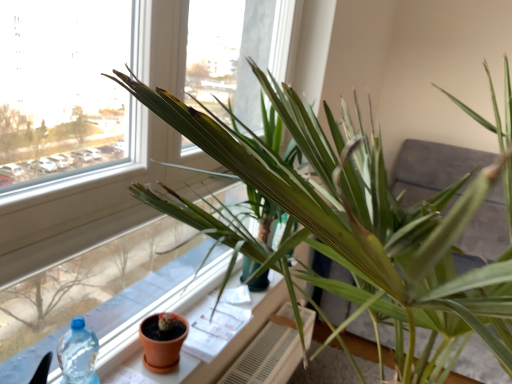
The height and width of the screenshot is (384, 512). What do you see at coordinates (160, 311) in the screenshot?
I see `terracotta clay pot at lower center` at bounding box center [160, 311].

Measure the distance between point (169, 338) and camera.

1.21 meters.

This screenshot has width=512, height=384. Find the location of `white textured radiator at lower center`. white textured radiator at lower center is located at coordinates (269, 353).

Is green matte plant at center located outside terracotta clay pot at lower left?

green matte plant at center is positioned outside terracotta clay pot at lower left.

Is green matte plant at center to the left or to the right of terracotta clay pot at lower left in the image?

In the image, green matte plant at center appears on the right side of terracotta clay pot at lower left.

Which object is closer to the camera taking this photo, green matte plant at center or terracotta clay pot at lower left?

green matte plant at center.

Consider the image. Considering the relative sizes of green matte plant at center and terracotta clay pot at lower left in the image provided, is green matte plant at center smaller than terracotta clay pot at lower left?

No.

Where is `radiator below the green matte plant at center (from a real-world perspective)`? This screenshot has height=384, width=512. radiator below the green matte plant at center (from a real-world perspective) is located at coordinates (269, 353).

Is white textured radiator at lower center looking in the opposite direction of green matte plant at center?

Correct, white textured radiator at lower center is looking away from green matte plant at center.

Can you tell me how much terracotta clay pot at lower center and terracotta clay pot at lower left differ in facing direction?

terracotta clay pot at lower center and terracotta clay pot at lower left are facing 3.34 degrees away from each other.

From a real-world perspective, which is physically below, terracotta clay pot at lower center or terracotta clay pot at lower left?

In real-world perspective, terracotta clay pot at lower center is lower.

Considering the relative positions of terracotta clay pot at lower center and terracotta clay pot at lower left in the image provided, is terracotta clay pot at lower center to the left of terracotta clay pot at lower left from the viewer's perspective?

No, terracotta clay pot at lower center is not to the left of terracotta clay pot at lower left.

Identify the location of flowerpot on the left of terracotta clay pot at lower center. Image resolution: width=512 pixels, height=384 pixels. (162, 342).

Is terracotta clay pot at lower left facing towards terracotta clay pot at lower center?

No.

From the image's perspective, is terracotta clay pot at lower left on top of terracotta clay pot at lower center?

Yes, from the image's perspective, terracotta clay pot at lower left is on top of terracotta clay pot at lower center.

Does terracotta clay pot at lower left appear on the right side of terracotta clay pot at lower center?

In fact, terracotta clay pot at lower left is to the left of terracotta clay pot at lower center.

Is point (169, 349) positioned after point (220, 364)?

No, (169, 349) is closer to viewer.

Does green matte plant at center touch white textured radiator at lower center?

No, green matte plant at center is not touching white textured radiator at lower center.

Is green matte plant at center taller than white textured radiator at lower center?

Yes, green matte plant at center is taller than white textured radiator at lower center.

Locate an element on the screen. houseplant above the white textured radiator at lower center (from a real-world perspective) is located at coordinates (353, 224).

Can you tell me how much terracotta clay pot at lower center and white textured radiator at lower center differ in facing direction?

1.19 degrees separate the facing orientations of terracotta clay pot at lower center and white textured radiator at lower center.

In the scene shown: From a real-world perspective, is terracotta clay pot at lower center above or below white textured radiator at lower center?

terracotta clay pot at lower center is situated higher than white textured radiator at lower center in the real world.

Identify the location of window sill in front of the white textured radiator at lower center. (160, 311).

From a real-world perspective, is terracotta clay pot at lower left positioned above or below green matte plant at center?

terracotta clay pot at lower left is below green matte plant at center.

Which is more to the left, terracotta clay pot at lower left or green matte plant at center?

terracotta clay pot at lower left.

Can you tell me how much terracotta clay pot at lower left and green matte plant at center differ in facing direction?

They differ by 4.53 degrees in their facing directions.

Can you confirm if terracotta clay pot at lower left is bigger than green matte plant at center?

No.

At what (x,y) coordinates should I click in order to perform the action: click on houseplant that is on the right side of terracotta clay pot at lower left. Please return your answer as a coordinate pair (x, y). The image size is (512, 384). Looking at the image, I should click on (353, 224).

I want to click on radiator below the green matte plant at center (from the image's perspective), so click(269, 353).

Considering their positions, is terracotta clay pot at lower center positioned further to green matte plant at center than terracotta clay pot at lower left?

terracotta clay pot at lower center.

Looking at the image, which one is located further to terracotta clay pot at lower left, white textured radiator at lower center or terracotta clay pot at lower center?

The object further to terracotta clay pot at lower left is white textured radiator at lower center.

Considering their positions, is green matte plant at center positioned closer to terracotta clay pot at lower center than white textured radiator at lower center?

Among the two, white textured radiator at lower center is located nearer to terracotta clay pot at lower center.

From the image, which object appears to be nearer to green matte plant at center, terracotta clay pot at lower left or white textured radiator at lower center?

terracotta clay pot at lower left lies closer to green matte plant at center than the other object.

Considering their positions, is terracotta clay pot at lower center positioned closer to white textured radiator at lower center than terracotta clay pot at lower left?

terracotta clay pot at lower center lies closer to white textured radiator at lower center than the other object.

Looking at the image, which one is located further to terracotta clay pot at lower left, terracotta clay pot at lower center or green matte plant at center?

Based on the image, green matte plant at center appears to be further to terracotta clay pot at lower left.

Considering their positions, is white textured radiator at lower center positioned further to terracotta clay pot at lower center than green matte plant at center?

green matte plant at center is positioned further to the anchor terracotta clay pot at lower center.

Looking at the image, which one is located closer to terracotta clay pot at lower left, green matte plant at center or white textured radiator at lower center?

white textured radiator at lower center is positioned closer to the anchor terracotta clay pot at lower left.

Locate an element on the screen. flowerpot between green matte plant at center and white textured radiator at lower center from front to back is located at coordinates (162, 342).

At what (x,y) coordinates should I click in order to perform the action: click on window sill between green matte plant at center and white textured radiator at lower center in the front-back direction. Please return your answer as a coordinate pair (x, y). Looking at the image, I should click on (160, 311).

Locate an element on the screen. This screenshot has width=512, height=384. window sill between terracotta clay pot at lower left and white textured radiator at lower center from left to right is located at coordinates 160,311.

Where is `window sill located between green matte plant at center and terracotta clay pot at lower left in the depth direction`? window sill located between green matte plant at center and terracotta clay pot at lower left in the depth direction is located at coordinates (160, 311).